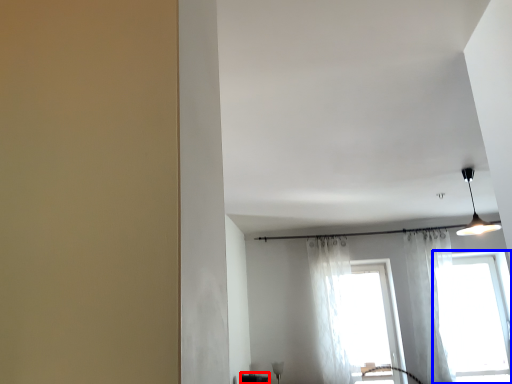
Question: Which of the following is the closest to the observer, furniture (highlighted by a red box) or window (highlighted by a blue box)?

Choices:
 (A) furniture
 (B) window

Answer: (B)